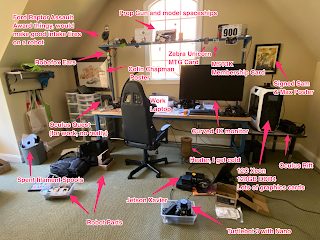
This screenshot has width=320, height=240. I want to click on front of computer hard drive, so click(272, 111).